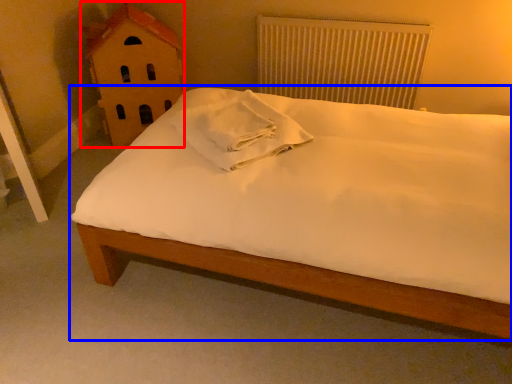
Question: Which of the following is the farthest to the observer, toy (highlighted by a red box) or bed (highlighted by a blue box)?

Choices:
 (A) toy
 (B) bed

Answer: (A)